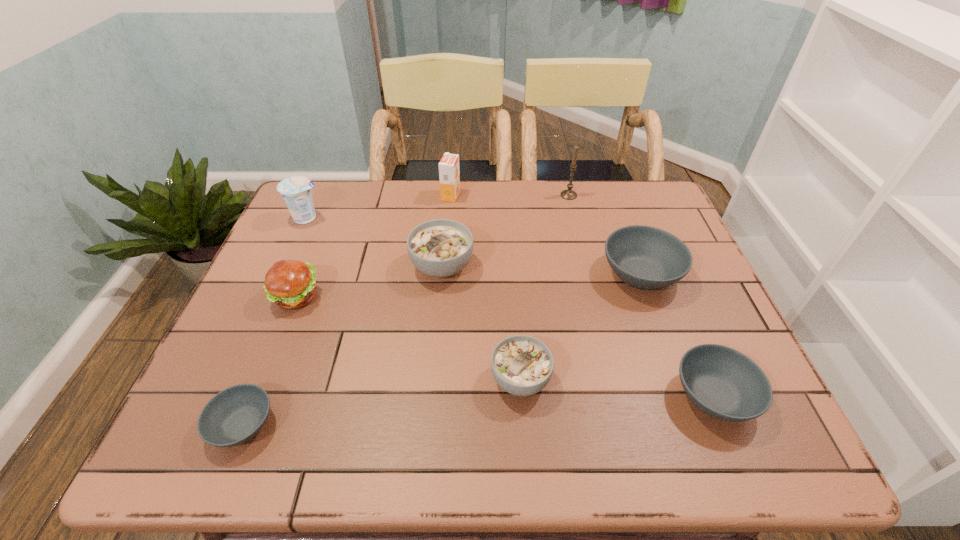
Locate which object ranks in proximity to the second shortest object. Please provide its 2D coordinates. Your answer should be formatted as a tuple, i.e. [(x, y)], where the tuple contains the x and y coordinates of a point satisfying the conditions above.

[(644, 257)]

The width and height of the screenshot is (960, 540). Identify the location of soup bowl that is the fifth closest one to the blue yogurt. (723, 382).

Locate which soup bowl is the fourth closest to the biggest gray soup bowl. Please provide its 2D coordinates. Your answer should be formatted as a tuple, i.e. [(x, y)], where the tuple contains the x and y coordinates of a point satisfying the conditions above.

[(236, 414)]

Point out which gray soup bowl is positioned as the third nearest to the hamburger. Please provide its 2D coordinates. Your answer should be formatted as a tuple, i.e. [(x, y)], where the tuple contains the x and y coordinates of a point satisfying the conditions above.

[(723, 382)]

Locate an element on the screen. gray soup bowl that can be found as the closest to the yogurt is located at coordinates (236, 414).

Image resolution: width=960 pixels, height=540 pixels. Identify the location of vacant area in the image that satisfies the following two spatial constraints: 1. on the front side of the fourth object from right to left; 2. on the right side of the second tallest object. (436, 379).

Locate an element on the screen. The width and height of the screenshot is (960, 540). blank space that satisfies the following two spatial constraints: 1. on the back side of the biggest gray soup bowl; 2. on the left side of the leftmost gray soup bowl is located at coordinates (304, 274).

Find the location of `blank area in the image that satisfies the following two spatial constraints: 1. on the front side of the fourth object from right to left; 2. on the left side of the left white soup bowl`. blank area in the image that satisfies the following two spatial constraints: 1. on the front side of the fourth object from right to left; 2. on the left side of the left white soup bowl is located at coordinates (432, 379).

Identify the location of free space that satisfies the following two spatial constraints: 1. on the front side of the orange juice; 2. on the right side of the second biggest gray soup bowl. This screenshot has width=960, height=540. (435, 396).